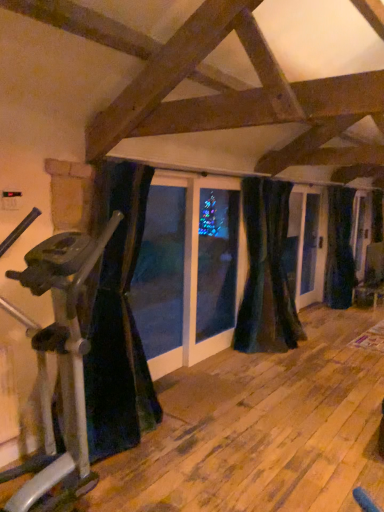
Find the location of a particular element. free point in front of black velvet curtain at left, arranged as the first curtain when viewed from the front is located at coordinates (153, 480).